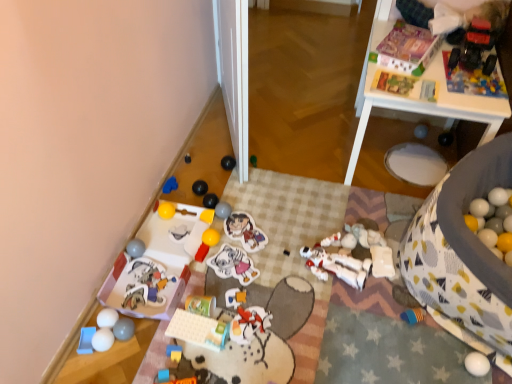
At what (x,y) coordinates should I click in order to perform the action: click on free space in front of matte plastic sticker at center, the seventh toy when ordered from right to left. Please return your answer as a coordinate pair (x, y). Image resolution: width=512 pixels, height=384 pixels. Looking at the image, I should click on (241, 274).